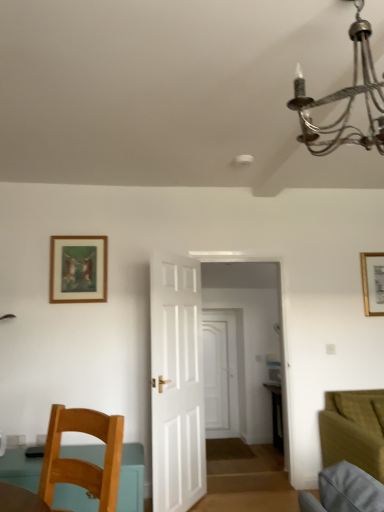
Question: Is teal matte table at lower left completely or partially outside of white matte door at center, the 2th door positioned from the front?

Choices:
 (A) yes
 (B) no

Answer: (A)

Question: Considering the relative sizes of teal matte table at lower left and white matte door at center, the 2th door positioned from the front, in the image provided, is teal matte table at lower left taller than white matte door at center, the 2th door positioned from the front,?

Choices:
 (A) yes
 (B) no

Answer: (B)

Question: Is white matte door at center, which is counted as the 2th door, starting from the left, at the back of teal matte table at lower left?

Choices:
 (A) no
 (B) yes

Answer: (B)

Question: Is teal matte table at lower left bigger than white matte door at center, the first door from the back?

Choices:
 (A) yes
 (B) no

Answer: (A)

Question: Considering the relative positions of teal matte table at lower left and white matte door at center, placed as the 1th door when sorted from right to left, in the image provided, is teal matte table at lower left behind white matte door at center, placed as the 1th door when sorted from right to left,?

Choices:
 (A) yes
 (B) no

Answer: (B)

Question: Does teal matte table at lower left have a lesser height compared to white matte door at center, which is counted as the 2th door, starting from the left?

Choices:
 (A) no
 (B) yes

Answer: (B)

Question: Does wooden chair at lower left have a lesser height compared to velvet olive green couch at lower right?

Choices:
 (A) yes
 (B) no

Answer: (A)

Question: Can you confirm if wooden chair at lower left is smaller than velvet olive green couch at lower right?

Choices:
 (A) no
 (B) yes

Answer: (B)

Question: Does wooden chair at lower left come behind velvet olive green couch at lower right?

Choices:
 (A) yes
 (B) no

Answer: (B)

Question: Is wooden chair at lower left outside of velvet olive green couch at lower right?

Choices:
 (A) yes
 (B) no

Answer: (A)

Question: Could you tell me if wooden chair at lower left is turned towards velvet olive green couch at lower right?

Choices:
 (A) yes
 (B) no

Answer: (B)

Question: From a real-world perspective, is wooden chair at lower left positioned under velvet olive green couch at lower right based on gravity?

Choices:
 (A) yes
 (B) no

Answer: (B)

Question: Are wooden chair at lower left and white wooden door at center, placed as the 2th door when sorted from right to left, located far from each other?

Choices:
 (A) no
 (B) yes

Answer: (B)